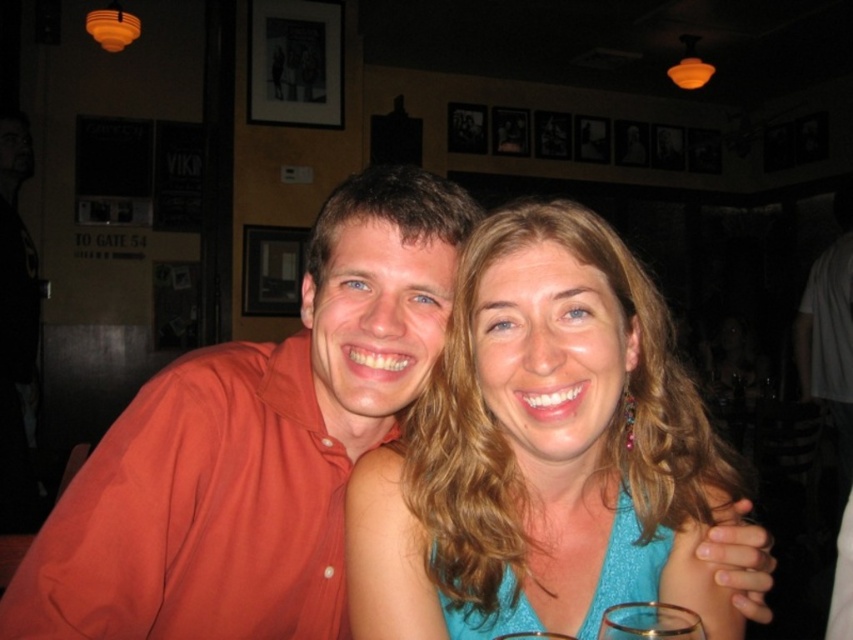
Question: Which of the following is the farthest from the observer?

Choices:
 (A) (618, 243)
 (B) (432, 312)

Answer: (B)

Question: Does blue fabric dress at center appear on the left side of orange cotton shirt at center?

Choices:
 (A) yes
 (B) no

Answer: (B)

Question: Which object is positioned farthest from the blue fabric dress at center?

Choices:
 (A) orange cotton shirt at center
 (B) transparent glass at lower center

Answer: (B)

Question: Is blue fabric dress at center positioned in front of orange cotton shirt at center?

Choices:
 (A) yes
 (B) no

Answer: (A)

Question: Is blue fabric dress at center in front of transparent glass at lower center?

Choices:
 (A) yes
 (B) no

Answer: (B)

Question: Based on their relative distances, which object is nearer to the blue fabric dress at center?

Choices:
 (A) orange cotton shirt at center
 (B) transparent glass at lower center

Answer: (A)